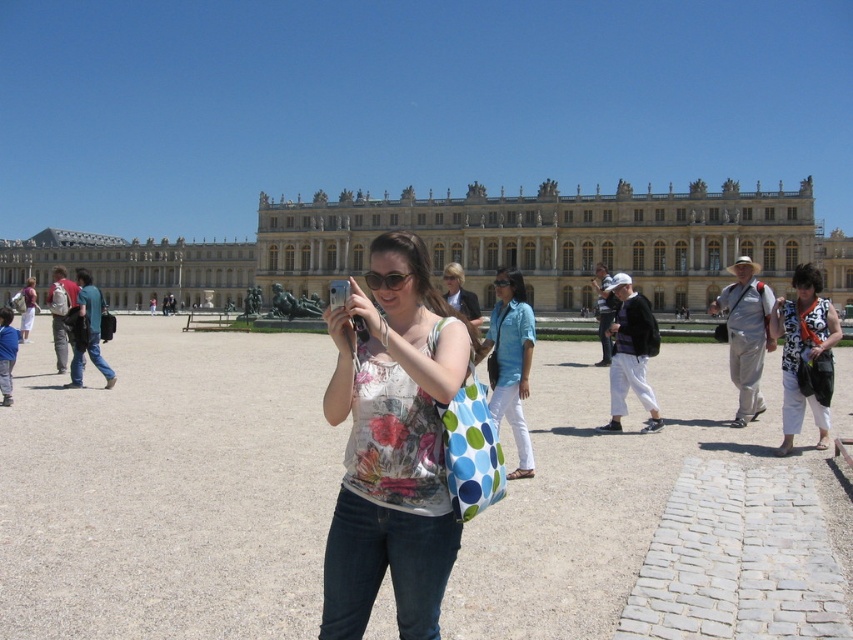
Is point (786, 392) positioned in front of point (90, 355)?

Yes, point (786, 392) is closer to viewer.

Which is in front, point (822, 316) or point (91, 340)?

Point (822, 316) is more forward.

Identify the location of white cotton shirt at right. The image size is (853, 640). (805, 355).

Who is positioned more to the left, floral printed tank top at center or white cotton pants at center?

From the viewer's perspective, floral printed tank top at center appears more on the left side.

Does floral printed tank top at center appear on the left side of white cotton pants at center?

Indeed, floral printed tank top at center is positioned on the left side of white cotton pants at center.

Locate an element on the screen. This screenshot has width=853, height=640. floral printed tank top at center is located at coordinates (392, 444).

Identify the location of floral printed tank top at center. click(x=392, y=444).

Who is taller, white cotton shirt at center or matte white shirt at center?

white cotton shirt at center is taller.

Is white cotton shirt at center to the left of matte white shirt at center from the viewer's perspective?

In fact, white cotton shirt at center is to the right of matte white shirt at center.

Measure the distance between point (613, 307) and camera.

The distance of point (613, 307) from camera is 368.61 feet.

I want to click on white cotton shirt at center, so click(x=604, y=310).